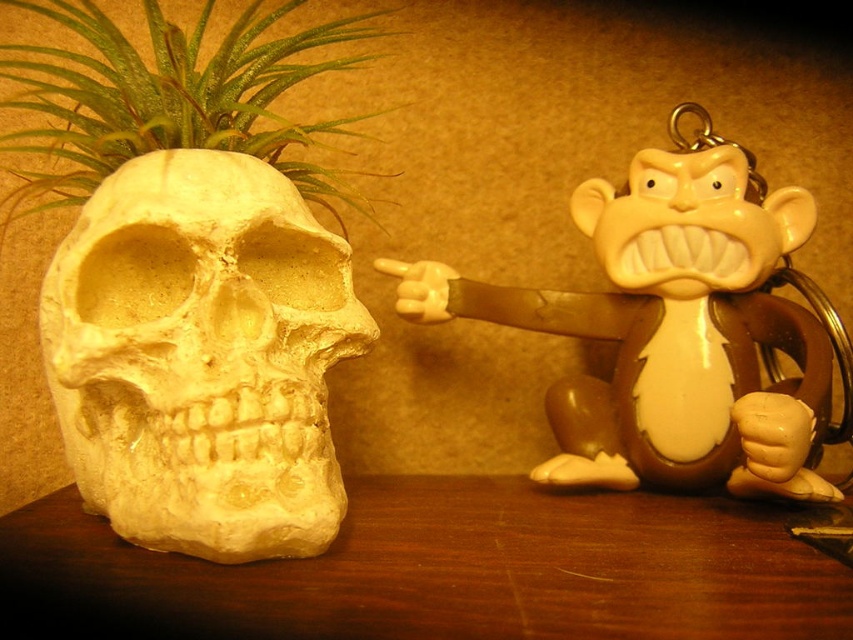
Does white matte skull at left have a greater width compared to green leafy plant at left?

No, white matte skull at left is not wider than green leafy plant at left.

This screenshot has width=853, height=640. What do you see at coordinates (201, 356) in the screenshot? I see `white matte skull at left` at bounding box center [201, 356].

Identify the location of white matte skull at left. (201, 356).

Can you confirm if wooden table at lower center is shorter than green leafy plant at left?

Yes.

Who is more distant from viewer, (x=757, y=593) or (x=276, y=10)?

Point (x=276, y=10)

Find the location of a particular element. wooden table at lower center is located at coordinates (461, 568).

Is point (273, 472) positioned in front of point (718, 449)?

Yes, point (273, 472) is closer to viewer.

Can you confirm if white matte skull at left is wider than matte brown monkey at right?

In fact, white matte skull at left might be narrower than matte brown monkey at right.

Is point (119, 289) positioned after point (775, 257)?

That is False.

Image resolution: width=853 pixels, height=640 pixels. I want to click on white matte skull at left, so click(x=201, y=356).